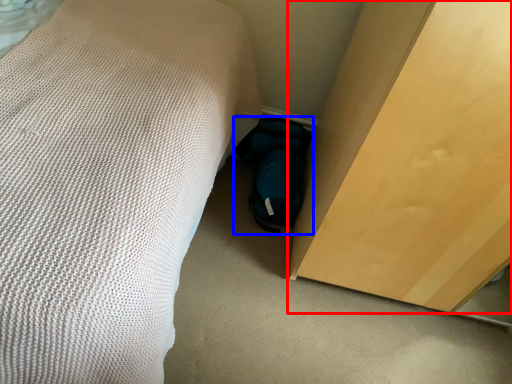
Question: Among these objects, which one is nearest to the camera, furniture (highlighted by a red box) or footwear (highlighted by a blue box)?

Choices:
 (A) furniture
 (B) footwear

Answer: (A)